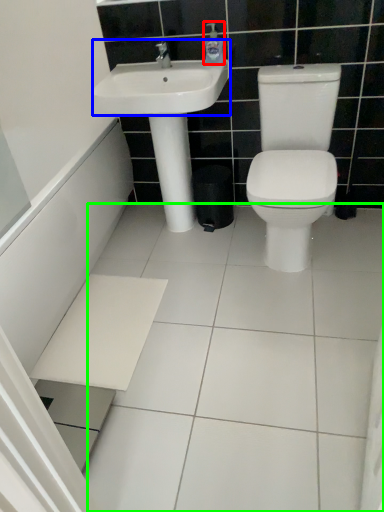
Question: Which is nearer to the soap dispenser (highlighted by a red box)? sink (highlighted by a blue box) or ceramic tile (highlighted by a green box).

Choices:
 (A) sink
 (B) ceramic tile

Answer: (A)